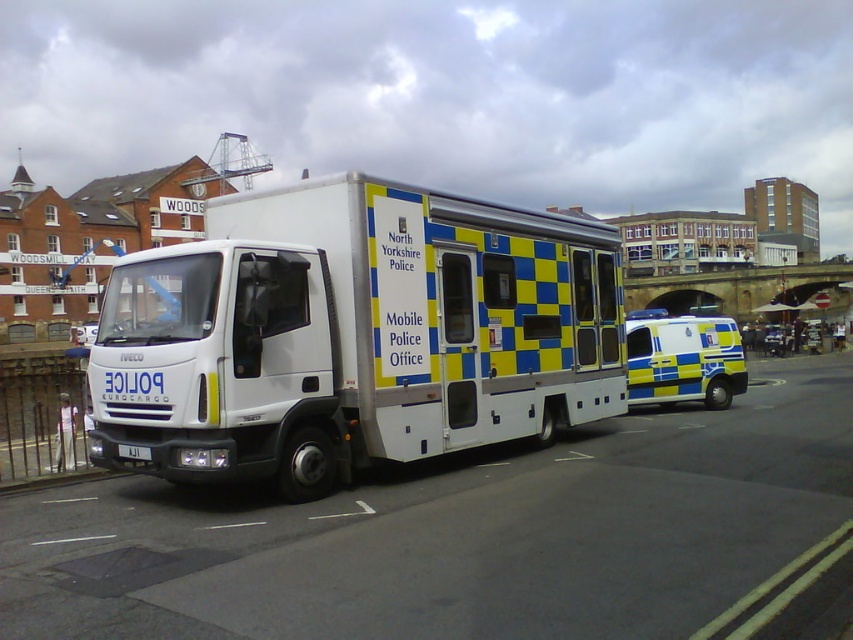
Based on the photo, you are a police officer standing at the point marked by coordinates (352, 333). From your current position, which direction should you walk to reach the smaller police van parked next to the white glossy mobile police office at center?

The point marked by coordinates (352, 333) is located at the white glossy mobile police office at center. Since the smaller police van is parked next to it, you should walk towards the direction where the smaller van is positioned relative to the truck. However, the exact direction cannot be determined without additional spatial information about their arrangement.

You are a pedestrian standing on the sidewalk and see both the white glossy mobile police office at center and the yellow and blue checkered ambulance at center. Which vehicle is nearer to you?

The white glossy mobile police office at center is closer to the viewer than the yellow and blue checkered ambulance at center.

Looking at this image, you are a delivery driver who needs to park your truck in a space that is only 2 meters tall. You see the white glossy mobile police office at center and the white plastic license plate at center. Which object would you compare the height of your truck to determine if it can fit?

The white glossy mobile police office at center is taller than the white plastic license plate at center. Since the license plate is much smaller, you should compare your truck to the height of the white glossy mobile police office at center to ensure it fits within the 2 meters limit.